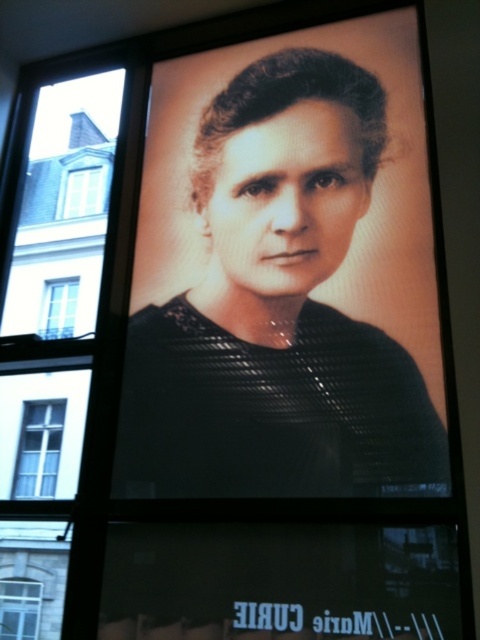
Does white glass window at upper left appear under clear glass window at upper left?

No.

Can you confirm if white glass window at upper left is positioned above clear glass window at upper left?

Correct, white glass window at upper left is located above clear glass window at upper left.

Does point (67, 177) come in front of point (44, 333)?

No.

I want to click on white glass window at upper left, so click(x=84, y=193).

Is black textured fabric at center below clear glass window at upper left?

No.

Between black textured fabric at center and clear glass window at upper left, which one appears on the right side from the viewer's perspective?

black textured fabric at center is more to the right.

Who is more distant from viewer, (336, 465) or (51, 328)?

Positioned behind is point (51, 328).

At what (x,y) coordinates should I click in order to perform the action: click on black textured fabric at center. Please return your answer as a coordinate pair (x, y). This screenshot has height=640, width=480. Looking at the image, I should click on (276, 310).

Does point (27, 616) come closer to viewer compared to point (83, 179)?

Yes.

Does clear glass window at lower left have a smaller size compared to white glass window at upper left?

Incorrect, clear glass window at lower left is not smaller in size than white glass window at upper left.

Locate an element on the screen. The image size is (480, 640). clear glass window at lower left is located at coordinates (20, 609).

Identify the location of clear glass window at lower left. This screenshot has height=640, width=480. (20, 609).